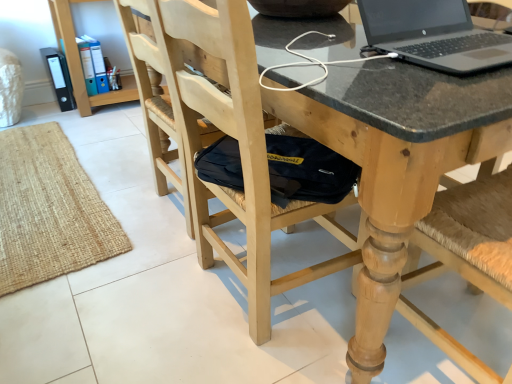
The image size is (512, 384). Describe the element at coordinates (468, 236) in the screenshot. I see `wooden chair at center, the first chair when ordered from right to left` at that location.

Locate an element on the screen. The height and width of the screenshot is (384, 512). natural wood chair at center, the first chair viewed from the left is located at coordinates (402, 130).

Would you say black glossy laptop at upper right contains natural wood chair at center, the first chair viewed from the left?

Definitely not — natural wood chair at center, the first chair viewed from the left, is not inside black glossy laptop at upper right.

Can you tell me how much black glossy laptop at upper right and natural wood chair at center, the first chair viewed from the left, differ in facing direction?

There is a 1.27-degree angle between the facing directions of black glossy laptop at upper right and natural wood chair at center, the first chair viewed from the left.

Where is `laptop above the natural wood chair at center, which is the second chair in right-to-left order (from the image's perspective)`? This screenshot has height=384, width=512. laptop above the natural wood chair at center, which is the second chair in right-to-left order (from the image's perspective) is located at coordinates (433, 35).

Looking at this image, is black glossy laptop at upper right wider or thinner than natural wood chair at center, which is the second chair in right-to-left order?

In the image, black glossy laptop at upper right appears to be more narrow than natural wood chair at center, which is the second chair in right-to-left order.

Is natural wood chair at center, the first chair viewed from the left, oriented towards wooden chair at center, the first chair when ordered from right to left?

Yes, natural wood chair at center, the first chair viewed from the left, is turned towards wooden chair at center, the first chair when ordered from right to left.

Between natural wood chair at center, the first chair viewed from the left, and wooden chair at center, the second chair in the left-to-right sequence, which one has more height?

wooden chair at center, the second chair in the left-to-right sequence.

Is point (465, 352) behind point (478, 281)?

Yes, it is.

Is matte black folders at upper left positioned far away from wooden chair at center, the first chair when ordered from right to left?

Yes.

Is matte black folders at upper left taller than wooden chair at center, the first chair when ordered from right to left?

Incorrect, the height of matte black folders at upper left is not larger of that of wooden chair at center, the first chair when ordered from right to left.

In the image, is matte black folders at upper left positioned in front of or behind wooden chair at center, the second chair in the left-to-right sequence?

Visually, matte black folders at upper left is located behind wooden chair at center, the second chair in the left-to-right sequence.

From the image's perspective, between matte black folders at upper left and wooden chair at center, the first chair when ordered from right to left, which one is located above?

matte black folders at upper left appears higher in the image.

Is black glossy laptop at upper right wider than wooden chair at center, the first chair when ordered from right to left?

Yes.

Are black glossy laptop at upper right and wooden chair at center, the second chair in the left-to-right sequence, located far from each other?

No, black glossy laptop at upper right is not far from wooden chair at center, the second chair in the left-to-right sequence.

This screenshot has height=384, width=512. Find the location of `laptop on the left of wooden chair at center, the second chair in the left-to-right sequence`. laptop on the left of wooden chair at center, the second chair in the left-to-right sequence is located at coordinates (433, 35).

Which object is positioned more to the left, black glossy laptop at upper right or wooden chair at center, the second chair in the left-to-right sequence?

Positioned to the left is black glossy laptop at upper right.

Is matte black folders at upper left bigger than black glossy laptop at upper right?

Indeed, matte black folders at upper left has a larger size compared to black glossy laptop at upper right.

There is a matte black folders at upper left. Where is `laptop above it (from a real-world perspective)`? This screenshot has height=384, width=512. laptop above it (from a real-world perspective) is located at coordinates (433, 35).

From the image's perspective, which is above, matte black folders at upper left or black glossy laptop at upper right?

matte black folders at upper left appears higher in the image.

Is matte black folders at upper left outside of black glossy laptop at upper right?

Yes, matte black folders at upper left is located beyond the bounds of black glossy laptop at upper right.

Which is in front, wooden chair at center, the first chair when ordered from right to left, or natural wood chair at center, the first chair viewed from the left?

wooden chair at center, the first chair when ordered from right to left.

Which object is positioned more to the right, wooden chair at center, the second chair in the left-to-right sequence, or natural wood chair at center, which is the second chair in right-to-left order?

Result: wooden chair at center, the second chair in the left-to-right sequence.

Is wooden chair at center, the first chair when ordered from right to left, touching natural wood chair at center, the first chair viewed from the left?

No.

Could you tell me if wooden chair at center, the first chair when ordered from right to left, is turned towards natural wood chair at center, which is the second chair in right-to-left order?

Yes, wooden chair at center, the first chair when ordered from right to left, is aimed at natural wood chair at center, which is the second chair in right-to-left order.

Visually, is wooden chair at center, the second chair in the left-to-right sequence, positioned to the left or to the right of black glossy laptop at upper right?

wooden chair at center, the second chair in the left-to-right sequence, is positioned on black glossy laptop at upper right's right side.

Is the surface of wooden chair at center, the first chair when ordered from right to left, in direct contact with black glossy laptop at upper right?

No, wooden chair at center, the first chair when ordered from right to left, is not beside black glossy laptop at upper right.

From a real-world perspective, which object rests below the other?

wooden chair at center, the second chair in the left-to-right sequence, is physically lower.

Is wooden chair at center, the first chair when ordered from right to left, inside or outside of black glossy laptop at upper right?

wooden chair at center, the first chair when ordered from right to left, is not enclosed by black glossy laptop at upper right.

Image resolution: width=512 pixels, height=384 pixels. I want to click on the 1st chair in front when counting from the black glossy laptop at upper right, so click(402, 130).

The height and width of the screenshot is (384, 512). Find the location of `chair below the natural wood chair at center, which is the second chair in right-to-left order (from the image's perspective)`. chair below the natural wood chair at center, which is the second chair in right-to-left order (from the image's perspective) is located at coordinates (468, 236).

Which object lies further to the anchor point matte black folders at upper left, black glossy laptop at upper right or natural wood chair at center, which is the second chair in right-to-left order?

The object further to matte black folders at upper left is natural wood chair at center, which is the second chair in right-to-left order.

Considering their positions, is natural wood chair at center, which is the second chair in right-to-left order, positioned further to wooden chair at center, the first chair when ordered from right to left, than matte black folders at upper left?

Among the two, matte black folders at upper left is located further to wooden chair at center, the first chair when ordered from right to left.

From the image, which object appears to be nearer to natural wood chair at center, the first chair viewed from the left, wooden chair at center, the second chair in the left-to-right sequence, or matte black folders at upper left?

wooden chair at center, the second chair in the left-to-right sequence, is positioned closer to the anchor natural wood chair at center, the first chair viewed from the left.

Looking at the image, which one is located closer to natural wood chair at center, which is the second chair in right-to-left order, black glossy laptop at upper right or wooden chair at center, the second chair in the left-to-right sequence?

Based on the image, wooden chair at center, the second chair in the left-to-right sequence, appears to be nearer to natural wood chair at center, which is the second chair in right-to-left order.

From the image, which object appears to be farther from black glossy laptop at upper right, wooden chair at center, the second chair in the left-to-right sequence, or matte black folders at upper left?

matte black folders at upper left.

Looking at the image, which one is located closer to black glossy laptop at upper right, matte black folders at upper left or natural wood chair at center, the first chair viewed from the left?

The object closer to black glossy laptop at upper right is natural wood chair at center, the first chair viewed from the left.

Looking at the image, which one is located closer to black glossy laptop at upper right, wooden chair at center, the first chair when ordered from right to left, or natural wood chair at center, which is the second chair in right-to-left order?

Based on the image, natural wood chair at center, which is the second chair in right-to-left order, appears to be nearer to black glossy laptop at upper right.

Looking at the image, which one is located further to wooden chair at center, the first chair when ordered from right to left, natural wood chair at center, the first chair viewed from the left, or black glossy laptop at upper right?

Among the two, black glossy laptop at upper right is located further to wooden chair at center, the first chair when ordered from right to left.

Identify the location of chair positioned between wooden chair at center, the first chair when ordered from right to left, and matte black folders at upper left from near to far. Image resolution: width=512 pixels, height=384 pixels. (402, 130).

In order to click on laptop positioned between wooden chair at center, the first chair when ordered from right to left, and matte black folders at upper left from near to far in this screenshot , I will do `click(433, 35)`.

Locate an element on the screen. chair between black glossy laptop at upper right and wooden chair at center, the first chair when ordered from right to left, from top to bottom is located at coordinates (402, 130).

Where is `laptop between natural wood chair at center, the first chair viewed from the left, and matte black folders at upper left, along the z-axis`? laptop between natural wood chair at center, the first chair viewed from the left, and matte black folders at upper left, along the z-axis is located at coordinates (433, 35).